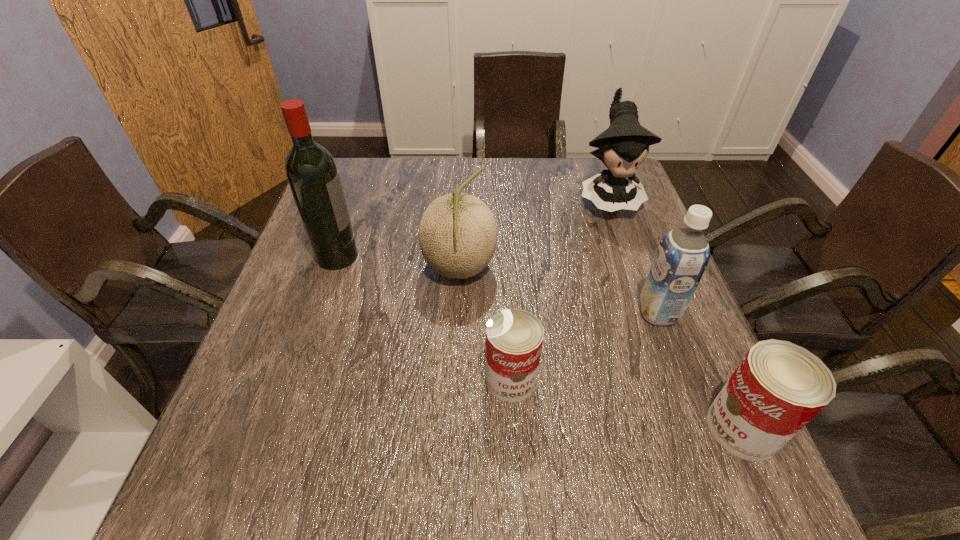
Locate an element on the screen. The width and height of the screenshot is (960, 540). object that is positioned at the left edge is located at coordinates (311, 171).

The height and width of the screenshot is (540, 960). Identify the location of can that is at the right edge. (778, 387).

This screenshot has height=540, width=960. Identify the location of doll that is at the right edge. (x=624, y=146).

Image resolution: width=960 pixels, height=540 pixels. I want to click on soya milk present at the right edge, so click(x=682, y=256).

Locate an element on the screen. The width and height of the screenshot is (960, 540). object located in the far right corner section of the desktop is located at coordinates (624, 146).

Locate an element on the screen. object that is at the near right corner is located at coordinates (778, 387).

You are a GUI agent. You are given a task and a screenshot of the screen. Output one action in this format:
    pyautogui.click(x=<x>, y=<y>)
    Task: Click on the vacant space at the far edge
    Image resolution: width=960 pixels, height=540 pixels.
    Given the screenshot: What is the action you would take?
    pyautogui.click(x=477, y=184)

Find the location of `vacant space at the left edge of the desktop`. vacant space at the left edge of the desktop is located at coordinates (349, 278).

The height and width of the screenshot is (540, 960). I want to click on vacant space at the right edge of the desktop, so click(x=671, y=326).

The height and width of the screenshot is (540, 960). What are the coordinates of `vacant space at the near right corner of the desktop` in the screenshot? It's located at (672, 430).